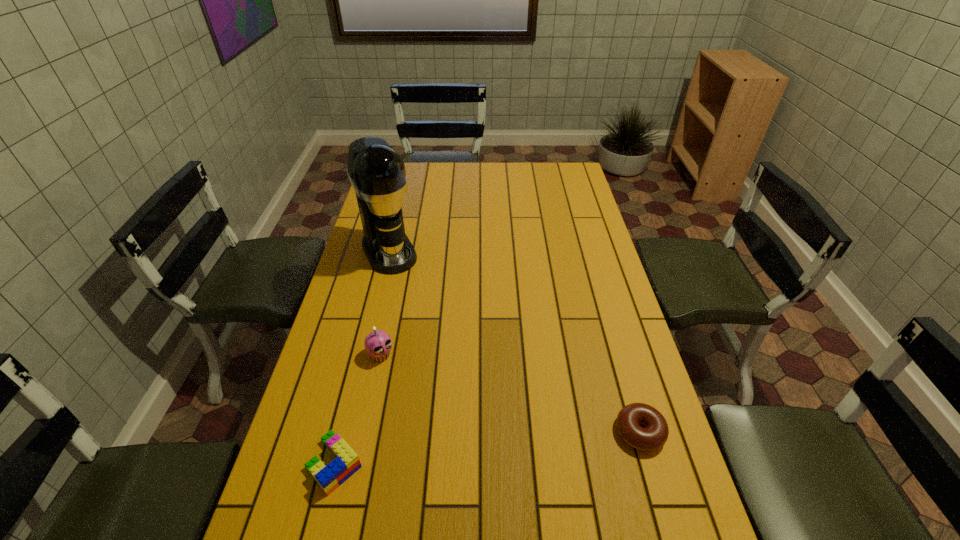
Identify the location of free space on the desktop that is between the Lego and the rightmost object and is positioned place cup under the spout of the coffee maker. Image resolution: width=960 pixels, height=540 pixels. (496, 447).

Locate an element on the screen. The width and height of the screenshot is (960, 540). free spot on the desktop that is between the Lego and the rightmost object and is positioned on the face of the cupcake is located at coordinates (472, 449).